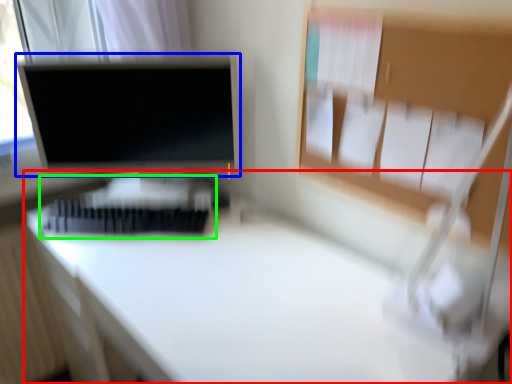
Question: Estimate the real-world distances between objects in this image. Which object is farther from desk (highlighted by a red box), computer monitor (highlighted by a blue box) or bed (highlighted by a green box)?

Choices:
 (A) computer monitor
 (B) bed

Answer: (A)